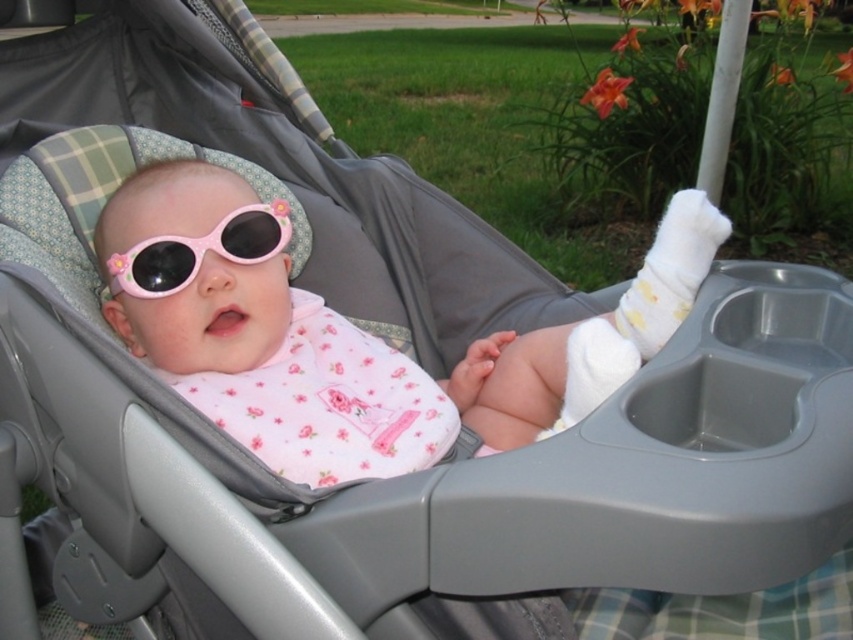
You are a photographer taking a closeup shot of the baby in the stroller. The pink glossy sunglasses at center might reflect the scene behind them. Based on the baby and stroller setup, where would the reflection in the sunglasses show?

The reflection in the pink glossy sunglasses at center would show the grassy area with orange flowers near a pole, as that is the background scene located behind the baby and stroller.

You are a parent trying to pack the baby items into a small bag that can only hold one item. The pink glossy sunglasses at center and the pink plastic goggles at center are both on the stroller tray. Which item is closer to the edge of the tray so you can grab it faster?

→ The pink glossy sunglasses at center are closer to the edge of the tray than the pink plastic goggles at center since the distance between them is 6.55 inches, implying the sunglasses are nearer to the edge.

You are a photographer trying to capture a closeup of the baby in the stroller. You need to decide which accessory, the pink glossy sunglasses at center or the pink plastic goggles at center, will be easier to focus on due to their size. Which one should you choose?

The pink glossy sunglasses at center is bigger than the pink plastic goggles at center, so the photographer should choose the pink glossy sunglasses at center for easier focusing.